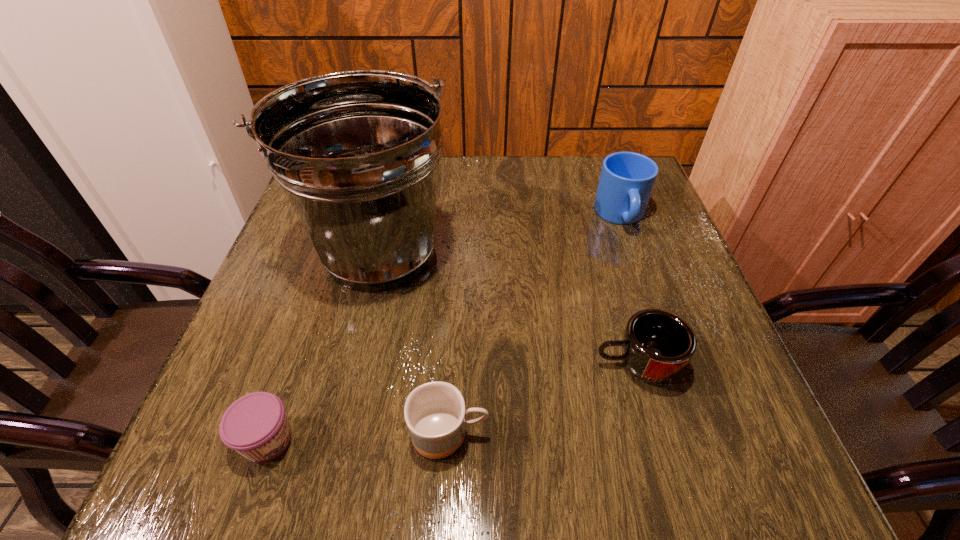
This screenshot has width=960, height=540. I want to click on vacant space located on the side of the second nearest mug with the handle, so click(x=544, y=364).

Locate an element on the screen. The width and height of the screenshot is (960, 540). vacant space positioned on the side with the handle of the leftmost mug is located at coordinates (569, 434).

This screenshot has height=540, width=960. I want to click on vacant region located 0.110m on the front label of the jam, so click(x=366, y=440).

Where is `object that is positioned at the far edge`? The height and width of the screenshot is (540, 960). object that is positioned at the far edge is located at coordinates [627, 179].

The image size is (960, 540). I want to click on mug that is positioned at the near edge, so click(x=435, y=414).

You are a GUI agent. You are given a task and a screenshot of the screen. Output one action in this format:
    pyautogui.click(x=<x>, y=<y>)
    Task: Click on the jam that is at the near edge
    
    Given the screenshot: What is the action you would take?
    pyautogui.click(x=256, y=426)

The width and height of the screenshot is (960, 540). I want to click on bucket that is at the left edge, so click(x=357, y=153).

This screenshot has width=960, height=540. Find the location of `jam at the left edge`. jam at the left edge is located at coordinates click(256, 426).

Locate an element on the screen. This screenshot has width=960, height=540. object present at the near left corner is located at coordinates (256, 426).

Where is `object present at the far right corner`? object present at the far right corner is located at coordinates (627, 179).